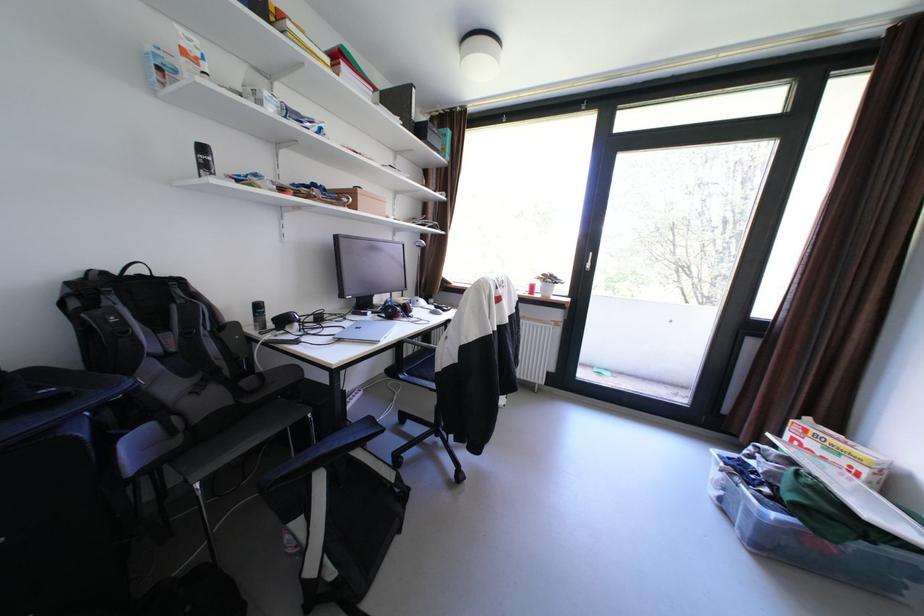
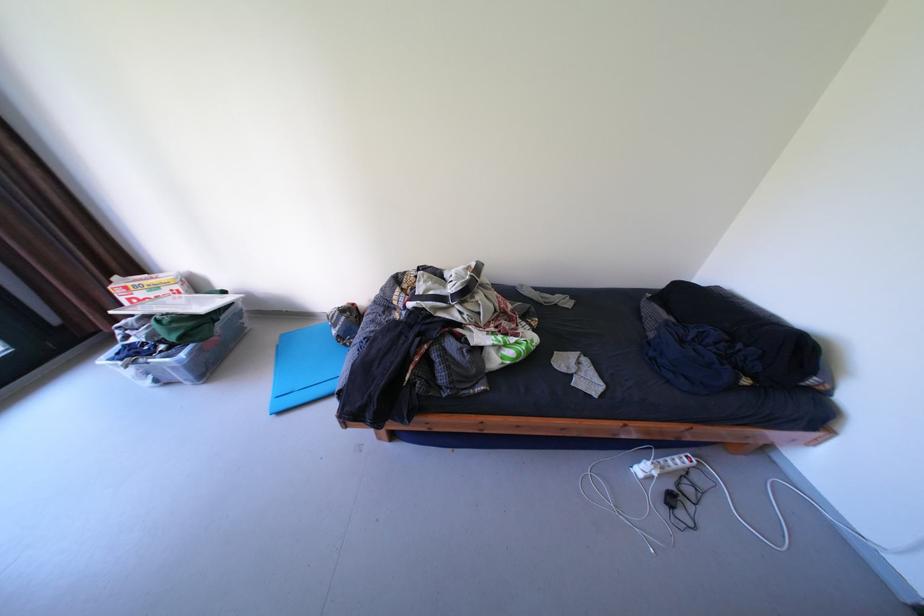
Where in the second image is the point corresponding to the point at 784,516 from the first image?

(193, 355)